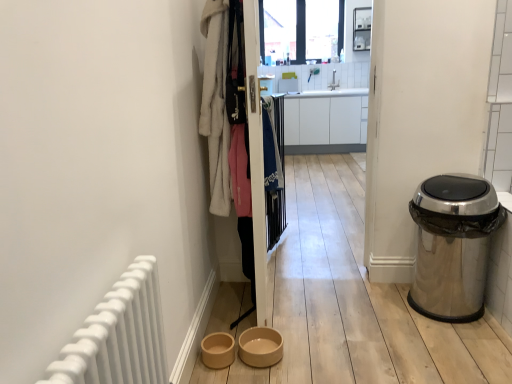
Identify the location of free point above white matte radiator at left (from a real-world perspective). (117, 293).